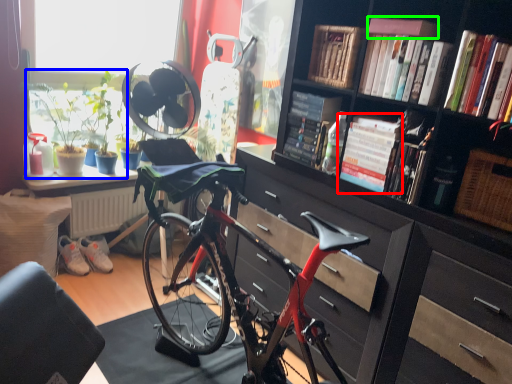
Question: Estimate the real-world distances between objects in this image. Which object is closer to book (highlighted by a red box), houseplant (highlighted by a blue box) or book (highlighted by a green box)?

Choices:
 (A) houseplant
 (B) book

Answer: (B)